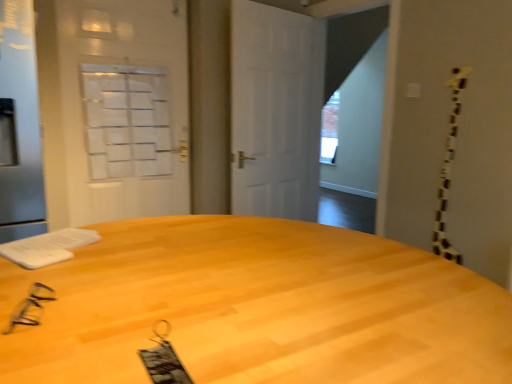
Where is `free location to the right of black plastic glasses at lower left`? This screenshot has height=384, width=512. free location to the right of black plastic glasses at lower left is located at coordinates (128, 314).